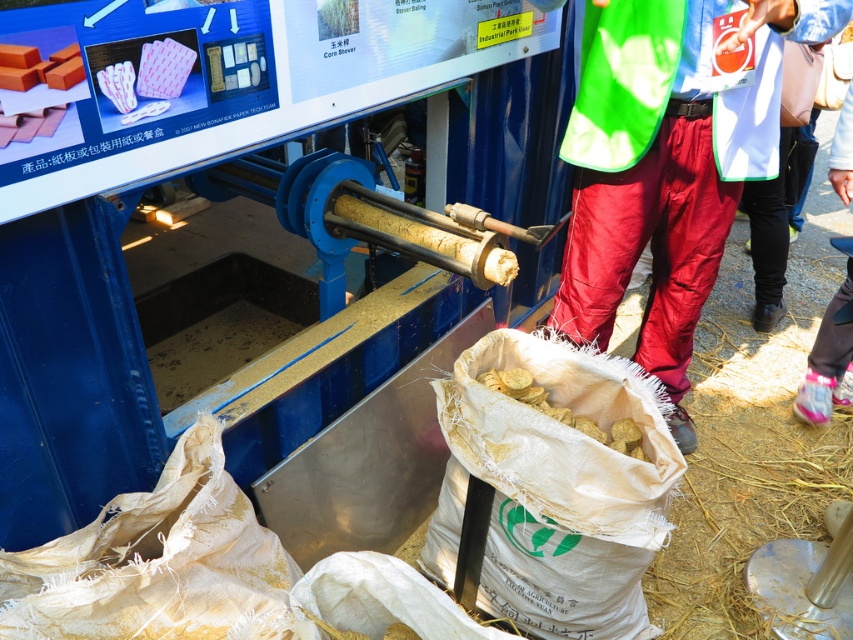
Question: Does red nylon pants at right have a smaller size compared to yellow matte chips at lower center?

Choices:
 (A) no
 (B) yes

Answer: (A)

Question: From the image, what is the correct spatial relationship of red nylon pants at right in relation to yellow matte chips at lower center?

Choices:
 (A) below
 (B) above

Answer: (B)

Question: Which object appears farthest from the camera in this image?

Choices:
 (A) yellow matte chips at lower center
 (B) red nylon pants at right

Answer: (A)

Question: Among these points, which one is nearest to the camera?

Choices:
 (A) (577, 413)
 (B) (677, 292)

Answer: (A)

Question: Which object appears farthest from the camera in this image?

Choices:
 (A) red nylon pants at right
 (B) yellow matte chips at lower center

Answer: (B)

Question: Does red nylon pants at right have a smaller size compared to yellow matte chips at lower center?

Choices:
 (A) yes
 (B) no

Answer: (B)